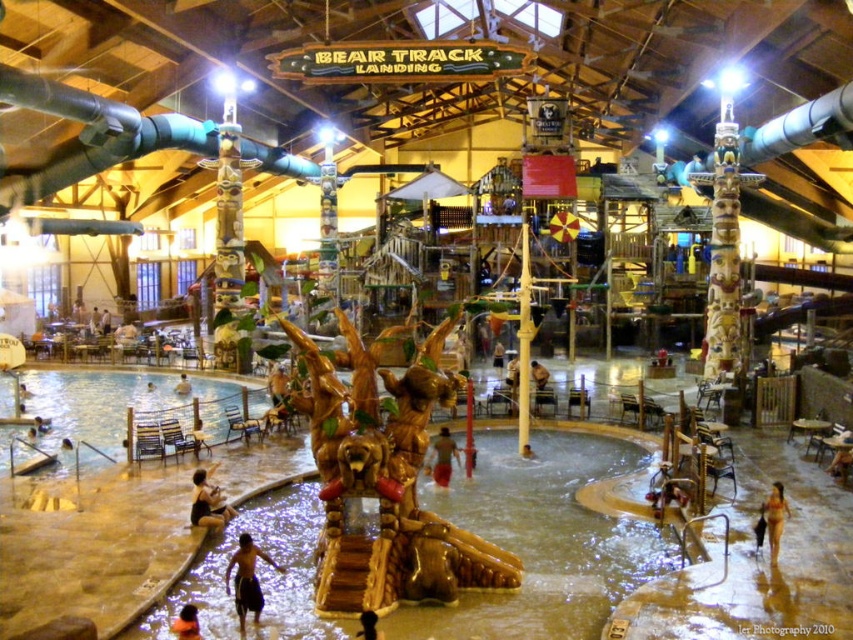
Which is more to the right, wooden statue at center or smooth black hair at center?

From the viewer's perspective, wooden statue at center appears more on the right side.

Between wooden statue at center and smooth black hair at center, which one has less height?

wooden statue at center

Does point (457, 456) come behind point (370, 616)?

That is True.

Where is `wooden statue at center`? The width and height of the screenshot is (853, 640). wooden statue at center is located at coordinates (442, 456).

Looking at this image, which is more to the right, brown leather shorts at lower center or smooth tan skin at center?

From the viewer's perspective, brown leather shorts at lower center appears more on the right side.

This screenshot has width=853, height=640. What do you see at coordinates (207, 502) in the screenshot?
I see `brown leather shorts at lower center` at bounding box center [207, 502].

Locate an element on the screen. This screenshot has width=853, height=640. brown leather shorts at lower center is located at coordinates (207, 502).

Who is higher up, smooth tan skin at center or brown wooden person at center?

smooth tan skin at center is above.

Between smooth tan skin at center and brown wooden person at center, which one appears on the right side from the viewer's perspective?

brown wooden person at center

What do you see at coordinates (183, 385) in the screenshot? Image resolution: width=853 pixels, height=640 pixels. I see `smooth tan skin at center` at bounding box center [183, 385].

You are a GUI agent. You are given a task and a screenshot of the screen. Output one action in this format:
    pyautogui.click(x=<x>, y=<y>)
    Task: Click on the smooth tan skin at center
    
    Given the screenshot: What is the action you would take?
    pyautogui.click(x=183, y=385)